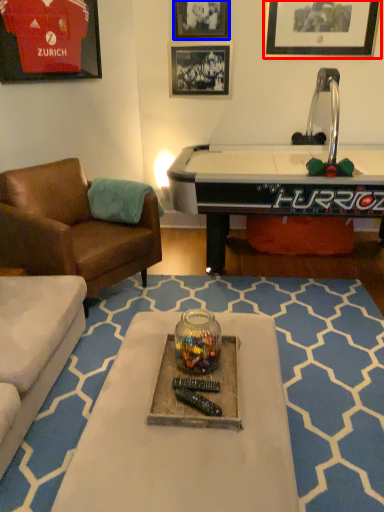
Question: Which object is closer to the camera taking this photo, picture frame (highlighted by a red box) or picture frame (highlighted by a blue box)?

Choices:
 (A) picture frame
 (B) picture frame

Answer: (A)